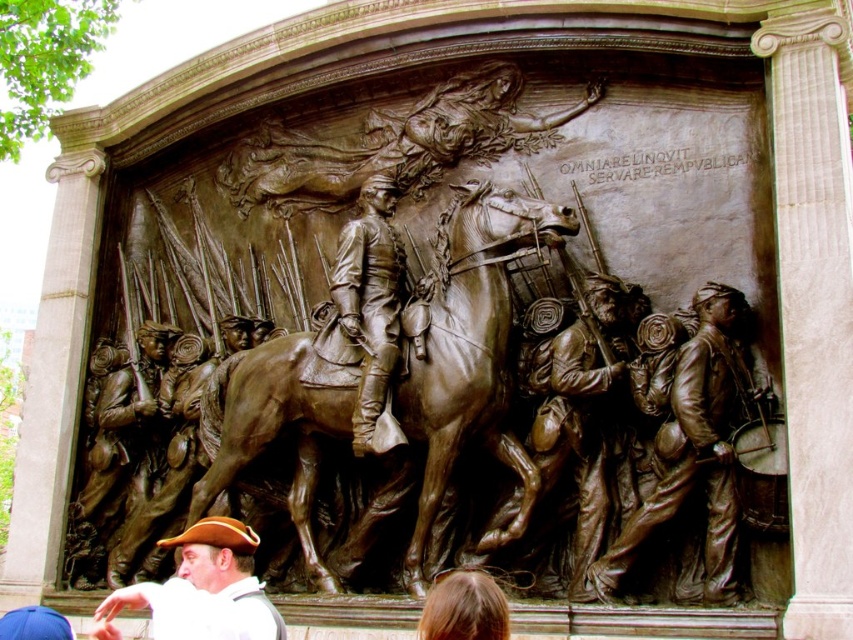
From the picture: You are an art conservator examining the bronze relief sculpture. You notice two points on the sculpture at coordinates point (701, 547) and point (368, 392). Which point is nearer to your current position as you inspect the sculpture?

Point (701, 547) is closer to the camera than point (368, 392), so the point (701, 547) is nearer to your current position as you inspect the sculpture.

You are an art conservator examining the bronze relief sculpture. You notice the bronze at center and the blonde hair at lower center. Which object is positioned higher in the relief?

The bronze at center is positioned higher than the blonde hair at lower center according to the description.